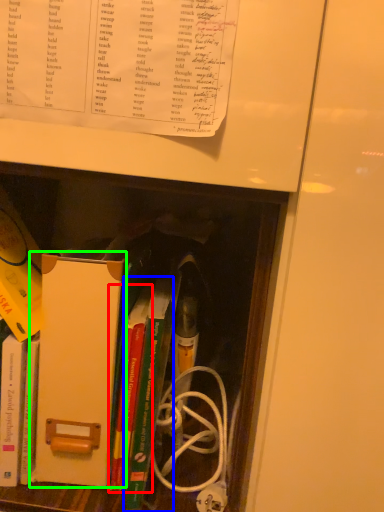
Question: Which object is positioned farthest from book (highlighted by a red box)? Select from book (highlighted by a blue box) and paperback book (highlighted by a green box).

Choices:
 (A) book
 (B) paperback book

Answer: (B)